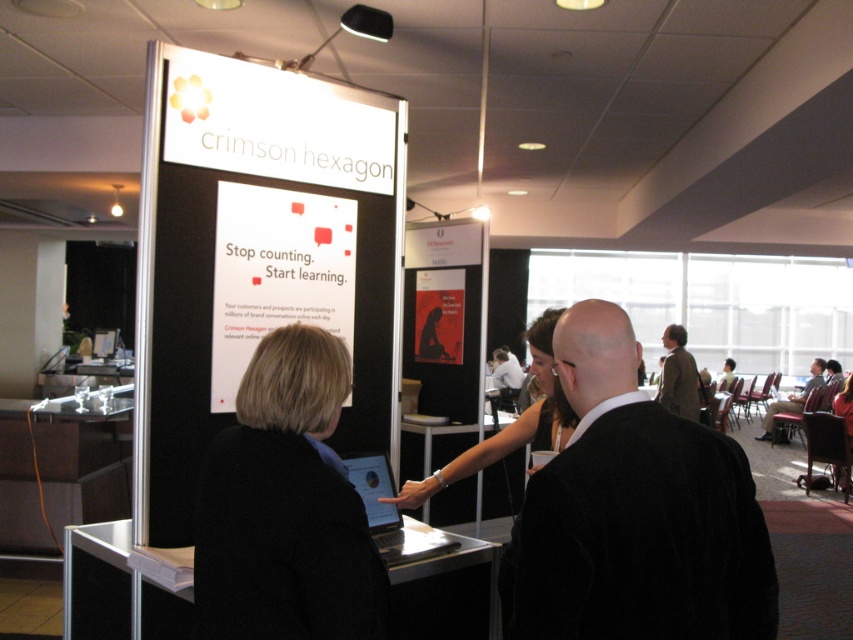
Question: Considering the real-world distances, which object is farthest from the dark brown leather chair at right?

Choices:
 (A) matte black jacket at center
 (B) matte black laptop at center
 (C) silver metallic laptop at center

Answer: (C)

Question: Which point appears closest to the camera in this image?

Choices:
 (A) (281, 625)
 (B) (373, 470)
 (C) (659, 397)

Answer: (A)

Question: Is black velvet jacket at center below silver metallic laptop at center?

Choices:
 (A) no
 (B) yes

Answer: (A)

Question: Is black velvet jacket at center thinner than dark brown leather chair at right?

Choices:
 (A) yes
 (B) no

Answer: (A)

Question: From the image, what is the correct spatial relationship of black velvet jacket at center in relation to dark brown leather chair at right?

Choices:
 (A) right
 (B) left

Answer: (B)

Question: Which of the following is the closest to the observer?

Choices:
 (A) (677, 416)
 (B) (824, 360)
 (C) (445, 484)

Answer: (C)